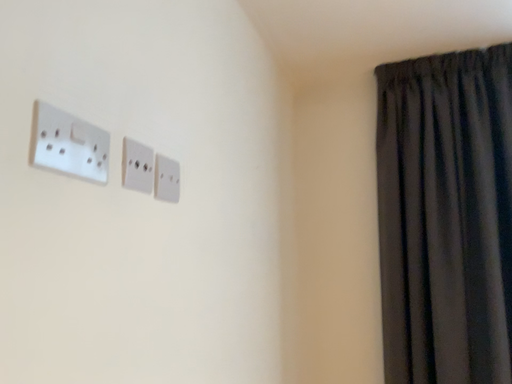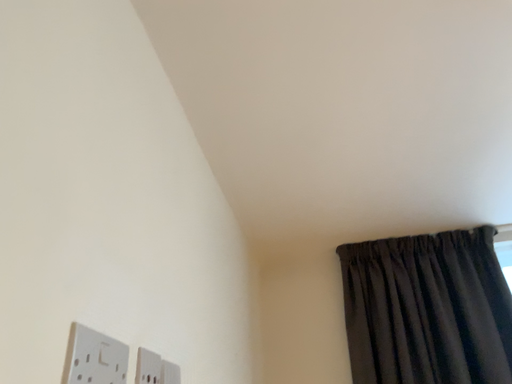
Question: How did the camera likely rotate when shooting the video?

Choices:
 (A) rotated left
 (B) rotated right

Answer: (B)